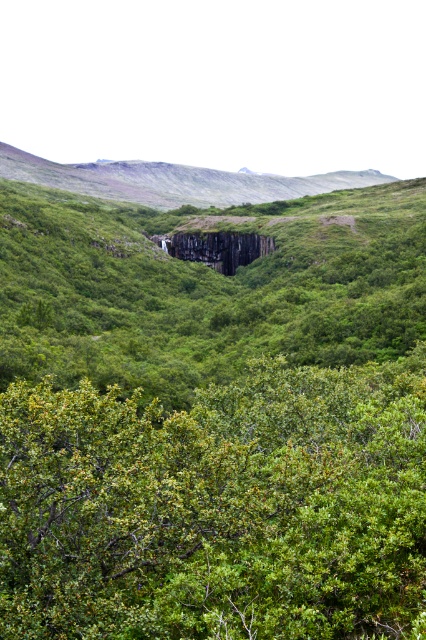
Question: Is green leafy bush at center to the left of black granite rock at center from the viewer's perspective?

Choices:
 (A) yes
 (B) no

Answer: (B)

Question: Can you confirm if green leafy bush at center is wider than black granite rock at center?

Choices:
 (A) yes
 (B) no

Answer: (B)

Question: Which of the following is the closest to the observer?

Choices:
 (A) black granite rock at center
 (B) green leafy bush at center

Answer: (B)

Question: Which of the following is the closest to the observer?

Choices:
 (A) green leafy bush at center
 (B) black granite rock at center

Answer: (A)

Question: Can you confirm if green leafy bush at center is positioned to the right of black granite rock at center?

Choices:
 (A) yes
 (B) no

Answer: (A)